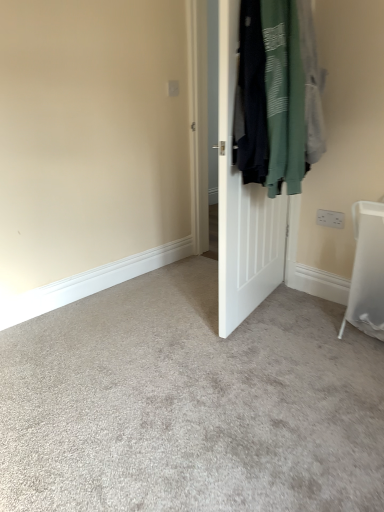
I want to click on vacant space to the left of white matte door at center, so click(168, 308).